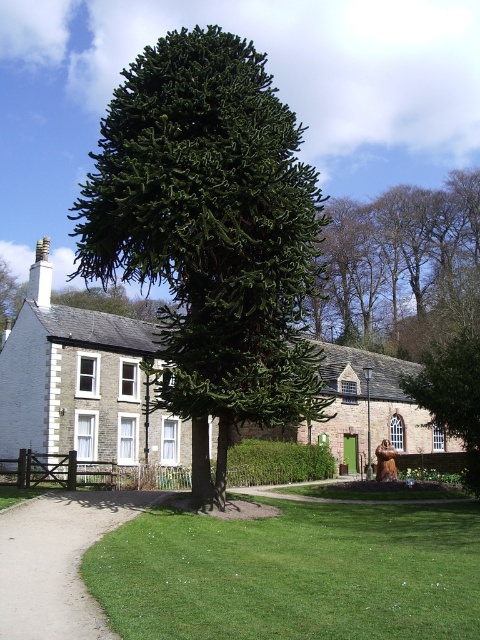
Question: Based on their relative distances, which object is nearer to the smooth gravel path at lower left?

Choices:
 (A) green leafy tree at center
 (B) green grass at center

Answer: (B)

Question: Does white stone cottage at center have a greater width compared to brown leafy tree at upper center?

Choices:
 (A) no
 (B) yes

Answer: (B)

Question: From the image, what is the correct spatial relationship of green textured tree at center in relation to green leafy tree at center?

Choices:
 (A) right
 (B) left

Answer: (B)

Question: Which point is closer to the camera taking this photo?

Choices:
 (A) (387, 262)
 (B) (469, 451)

Answer: (B)

Question: Considering the relative positions of green textured tree at center and white stone cottage at center in the image provided, where is green textured tree at center located with respect to white stone cottage at center?

Choices:
 (A) right
 (B) left

Answer: (B)

Question: Estimate the real-world distances between objects in this image. Which object is closer to the white stone cottage at center?

Choices:
 (A) green leafy tree at center
 (B) brown leafy tree at upper center

Answer: (A)